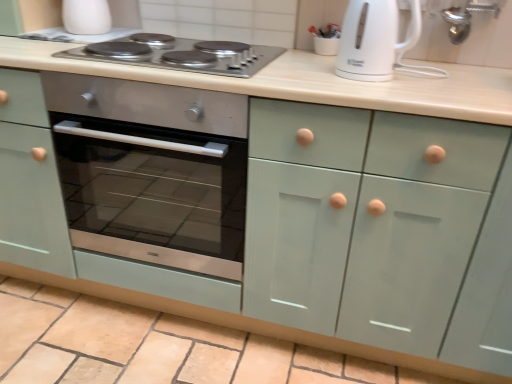
The width and height of the screenshot is (512, 384). In order to click on free spot to the right of white glossy electric kettle at upper right in this screenshot , I will do `click(435, 81)`.